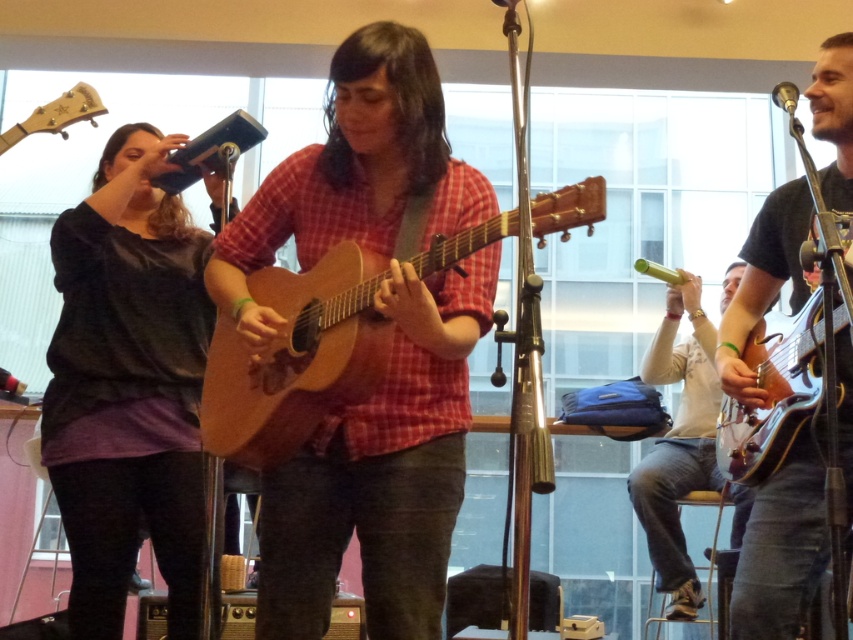
Question: Which of the following is the farthest from the observer?

Choices:
 (A) (836, 296)
 (B) (663, 321)

Answer: (B)

Question: Which point is farther to the camera?

Choices:
 (A) white matte shirt at right
 (B) wooden acoustic guitar at right

Answer: (A)

Question: From the image, what is the correct spatial relationship of wooden acoustic guitar at center in relation to natural wood acoustic guitar at center?

Choices:
 (A) left
 (B) right

Answer: (A)

Question: Is wooden acoustic guitar at center thinner than white matte shirt at right?

Choices:
 (A) no
 (B) yes

Answer: (A)

Question: Estimate the real-world distances between objects in this image. Which object is closer to the white matte shirt at right?

Choices:
 (A) dark gray shirt at left
 (B) wooden acoustic guitar at right

Answer: (B)

Question: Is natural wood acoustic guitar at center smaller than wooden acoustic guitar at right?

Choices:
 (A) no
 (B) yes

Answer: (A)